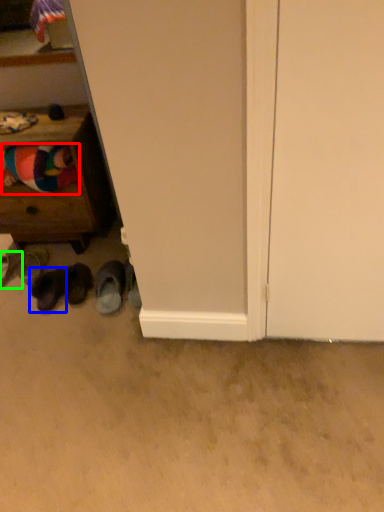
Question: Considering the real-world distances, which object is closest to clothing (highlighted by a red box)? footwear (highlighted by a blue box) or footwear (highlighted by a green box).

Choices:
 (A) footwear
 (B) footwear

Answer: (A)